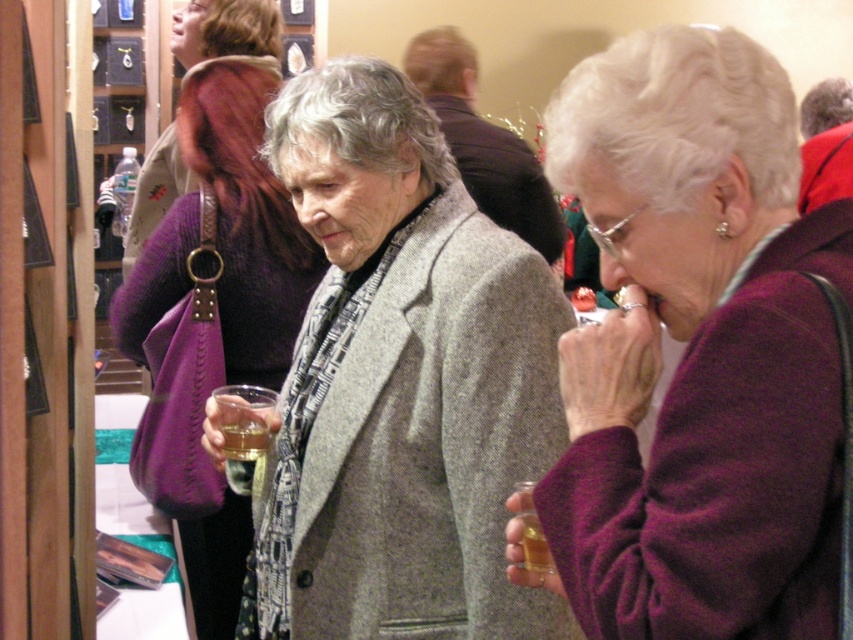
Based on the photo, you are helping organize a coat check at the event. You have a small hook that can only hold items up to the height of the purple wool sweater at right. Can the gray woolen coat at center be safely hung on this hook without bending it?

The purple wool sweater at right is not as tall as the gray woolen coat at center, meaning the coat is taller. Since the hook can only hold items up to the sweater height, the gray woolen coat at center would be too tall and might bend the hook if hung there.